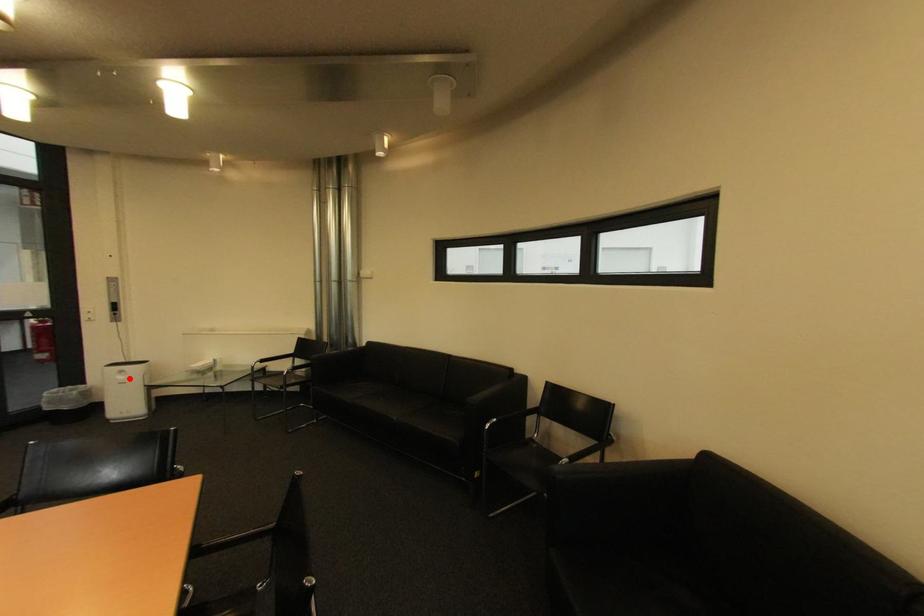
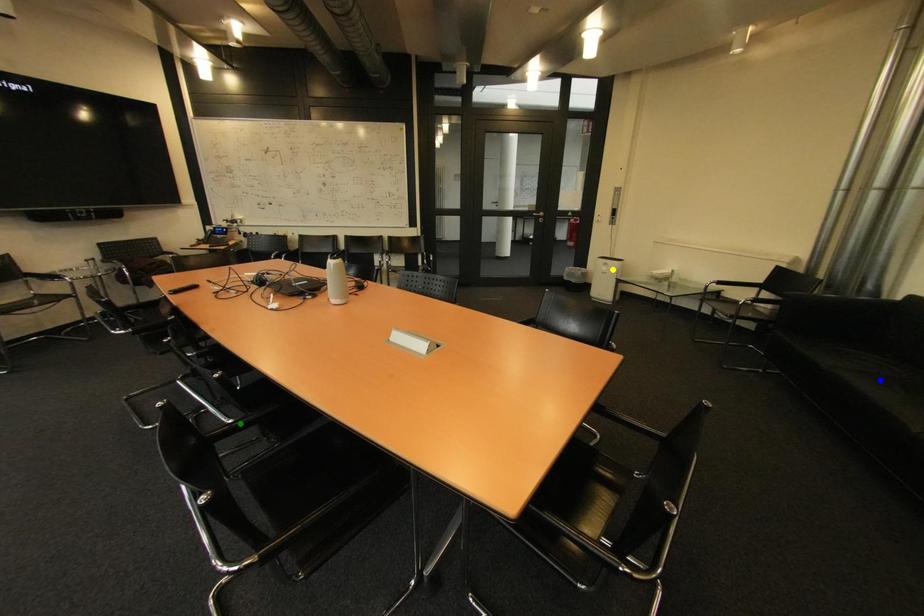
Question: I am providing you with two images of the same scene from different viewpoints. A red point is marked on the first image. You are given multiple points on the second image. Which point in image 2 is actually the same real-world point as the red point in image 1?

Choices:
 (A) green point
 (B) yellow point
 (C) blue point

Answer: (B)